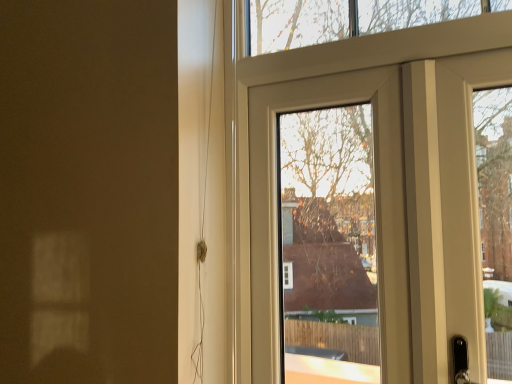
Question: Should I look upward or downward to see matte white door at center, acting as the first door starting from the left?

Choices:
 (A) down
 (B) up

Answer: (A)

Question: From a real-world perspective, is matte white door at center, which is counted as the 2th door, starting from the right, on top of matte white door at upper right, the second door viewed from the left?

Choices:
 (A) no
 (B) yes

Answer: (A)

Question: Is matte white door at center, acting as the first door starting from the left, surrounding matte white door at upper right, which ranks as the first door in right-to-left order?

Choices:
 (A) no
 (B) yes

Answer: (A)

Question: Does matte white door at center, acting as the first door starting from the left, have a greater height compared to matte white door at upper right, which ranks as the first door in right-to-left order?

Choices:
 (A) yes
 (B) no

Answer: (B)

Question: Would you say matte white door at center, acting as the first door starting from the left, is a long distance from matte white door at upper right, which ranks as the first door in right-to-left order?

Choices:
 (A) no
 (B) yes

Answer: (A)

Question: Does matte white door at center, which is counted as the 2th door, starting from the right, have a lesser width compared to matte white door at upper right, the second door viewed from the left?

Choices:
 (A) yes
 (B) no

Answer: (A)

Question: Is matte white door at center, which is counted as the 2th door, starting from the right, smaller than matte white door at upper right, the second door viewed from the left?

Choices:
 (A) yes
 (B) no

Answer: (A)

Question: Can matte white door at center, which is counted as the 2th door, starting from the right, be found inside matte white door at upper right, which ranks as the first door in right-to-left order?

Choices:
 (A) yes
 (B) no

Answer: (A)

Question: Is matte white door at upper right, which ranks as the first door in right-to-left order, oriented towards matte white door at center, which is counted as the 2th door, starting from the right?

Choices:
 (A) yes
 (B) no

Answer: (A)

Question: Does matte white door at upper right, the second door viewed from the left, come behind matte white door at center, acting as the first door starting from the left?

Choices:
 (A) yes
 (B) no

Answer: (B)

Question: Does matte white door at upper right, which ranks as the first door in right-to-left order, appear on the right side of matte white door at center, acting as the first door starting from the left?

Choices:
 (A) no
 (B) yes

Answer: (B)

Question: From the image's perspective, is matte white door at upper right, the second door viewed from the left, below matte white door at center, which is counted as the 2th door, starting from the right?

Choices:
 (A) yes
 (B) no

Answer: (B)

Question: Considering the relative sizes of matte white door at upper right, the second door viewed from the left, and matte white door at center, which is counted as the 2th door, starting from the right, in the image provided, is matte white door at upper right, the second door viewed from the left, thinner than matte white door at center, which is counted as the 2th door, starting from the right,?

Choices:
 (A) yes
 (B) no

Answer: (B)

Question: Which is correct: matte white door at center, which is counted as the 2th door, starting from the right, is inside matte white door at upper right, which ranks as the first door in right-to-left order, or outside of it?

Choices:
 (A) outside
 (B) inside

Answer: (B)